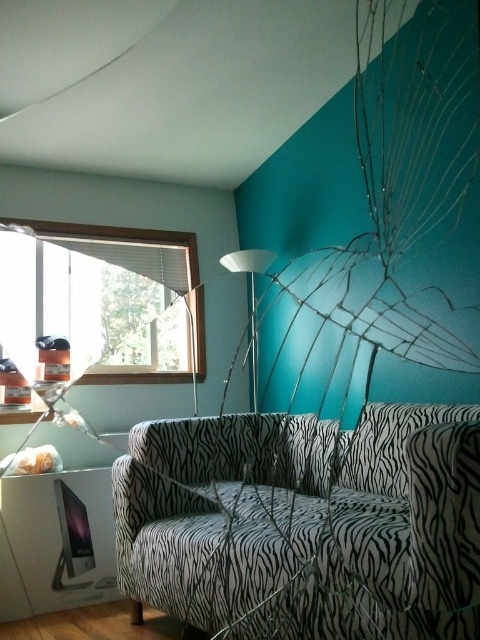
Does point (90, 232) come behind point (230, 260)?

Yes, it is behind point (230, 260).

Who is lower down, wooden frame at left or white glossy floor lamp at center?

Positioned lower is white glossy floor lamp at center.

The image size is (480, 640). What do you see at coordinates (143, 243) in the screenshot? I see `wooden frame at left` at bounding box center [143, 243].

You are a GUI agent. You are given a task and a screenshot of the screen. Output one action in this format:
    pyautogui.click(x=<x>, y=<y>)
    Task: Click on the wooden frame at left
    
    Given the screenshot: What is the action you would take?
    pyautogui.click(x=143, y=243)

Is zebra-patterned fabric couch at center wider than white glossy floor lamp at center?

Yes.

Between zebra-patterned fabric couch at center and white glossy floor lamp at center, which one appears on the left side from the viewer's perspective?

From the viewer's perspective, white glossy floor lamp at center appears more on the left side.

Locate an element on the screen. zebra-patterned fabric couch at center is located at coordinates (307, 524).

At what (x,y) coordinates should I click in order to perform the action: click on zebra-patterned fabric couch at center. Please return your answer as a coordinate pair (x, y). Looking at the image, I should click on (307, 524).

Between zebra-patterned fabric couch at center and wooden frame at left, which one has more height?

wooden frame at left is taller.

This screenshot has width=480, height=640. Describe the element at coordinates (307, 524) in the screenshot. I see `zebra-patterned fabric couch at center` at that location.

I want to click on zebra-patterned fabric couch at center, so click(x=307, y=524).